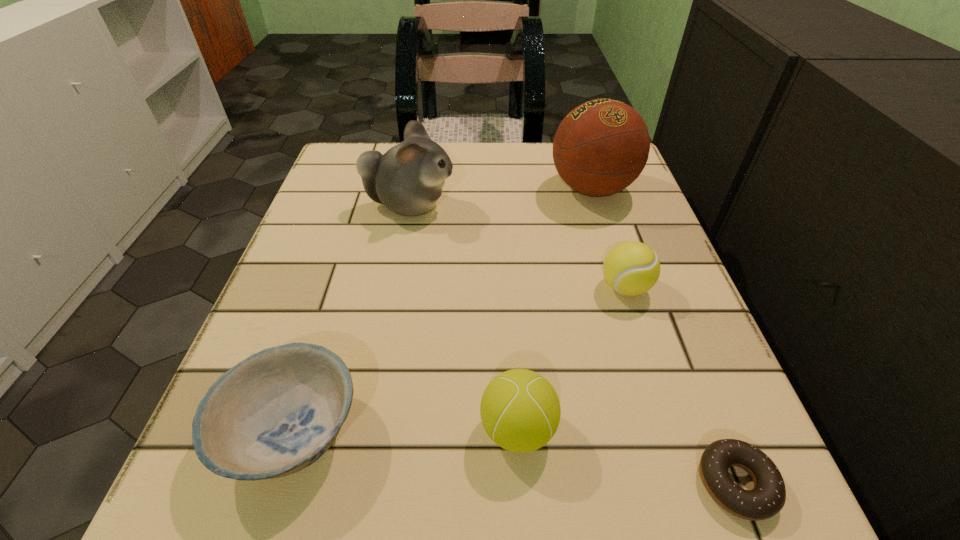
Identify the location of bowl located at the left edge. (275, 413).

Image resolution: width=960 pixels, height=540 pixels. Identify the location of basketball at the right edge. (601, 147).

Locate an element on the screen. The height and width of the screenshot is (540, 960). tennis ball present at the right edge is located at coordinates (631, 268).

Image resolution: width=960 pixels, height=540 pixels. Identify the location of doughnut located in the right edge section of the desktop. (767, 498).

Find the location of `object that is at the far left corner`. object that is at the far left corner is located at coordinates (408, 179).

Where is `object that is at the near left corner`? This screenshot has width=960, height=540. object that is at the near left corner is located at coordinates (275, 413).

Locate an element on the screen. object situated at the far right corner is located at coordinates (601, 147).

This screenshot has width=960, height=540. Find the location of `object at the near right corner`. object at the near right corner is located at coordinates (767, 498).

I want to click on vacant space at the far edge of the desktop, so click(x=465, y=158).

Find the location of a particular element. This screenshot has width=960, height=540. free region at the near edge of the desktop is located at coordinates [x=352, y=500].